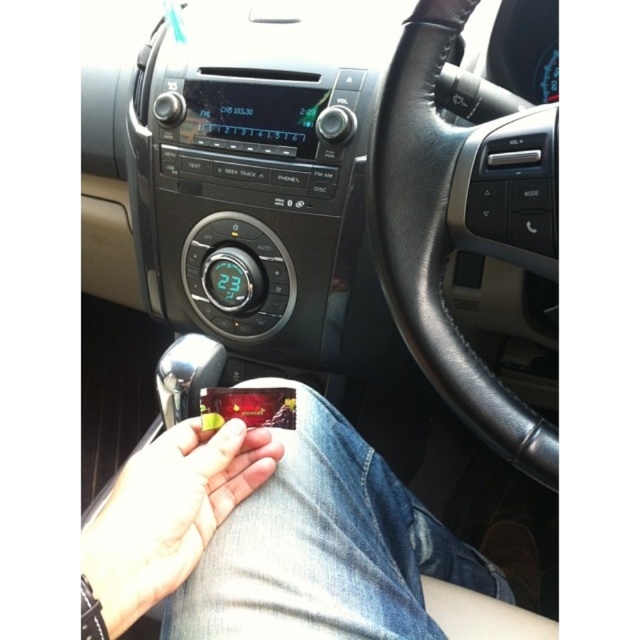
Question: Can you confirm if matte black steering wheel at center is positioned below matte plastic candy at lower center?

Choices:
 (A) yes
 (B) no

Answer: (B)

Question: Among these points, which one is farthest from the camera?

Choices:
 (A) (128, 596)
 (B) (426, 365)
 (C) (252, 579)
 (D) (362, 456)

Answer: (D)

Question: Which is farther from the matte black steering wheel at center?

Choices:
 (A) matte plastic candy at lower center
 (B) black leather steering wheel at center
 (C) smooth leather hand at center

Answer: (A)

Question: Among these points, which one is nearest to the camera?

Choices:
 (A) (209, 298)
 (B) (410, 218)

Answer: (B)

Question: Where is black leather steering wheel at center located in relation to matte plastic candy at lower center in the image?

Choices:
 (A) right
 (B) left

Answer: (A)

Question: Is the position of smooth leather hand at center more distant than that of matte plastic candy at lower center?

Choices:
 (A) no
 (B) yes

Answer: (B)